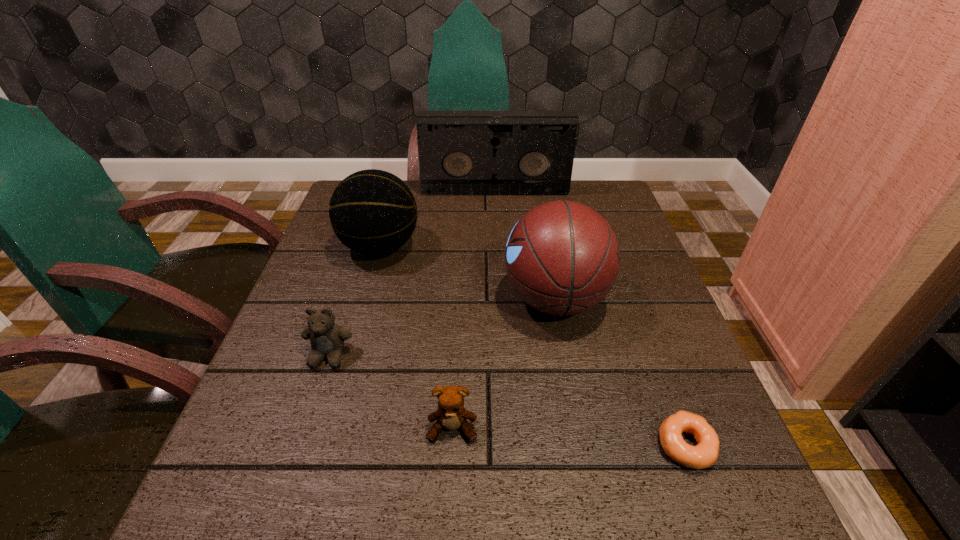
In order to click on vacant region located 0.350m on the front of the right basketball in this screenshot , I will do `click(598, 530)`.

Locate an element on the screen. The image size is (960, 540). free space located on the right of the left basketball is located at coordinates (571, 247).

Find the location of a particular element. free space located on the face of the third shortest object is located at coordinates (287, 485).

Identify the location of vacant space positioned 0.050m on the front-facing side of the shorter teddy bear. (450, 475).

Find the location of a particular element. This screenshot has height=540, width=960. blank space located on the back of the doughnut is located at coordinates (667, 394).

This screenshot has height=540, width=960. What are the coordinates of `videotape at the far edge` in the screenshot? It's located at pyautogui.click(x=460, y=152).

The width and height of the screenshot is (960, 540). I want to click on basketball at the far edge, so click(373, 212).

Locate an element on the screen. basketball present at the left edge is located at coordinates (373, 212).

This screenshot has height=540, width=960. I want to click on teddy bear located at the left edge, so pyautogui.click(x=327, y=338).

At what (x,y) coordinates should I click in order to perform the action: click on videotape that is at the right edge. Please return your answer as a coordinate pair (x, y). This screenshot has width=960, height=540. Looking at the image, I should click on (460, 152).